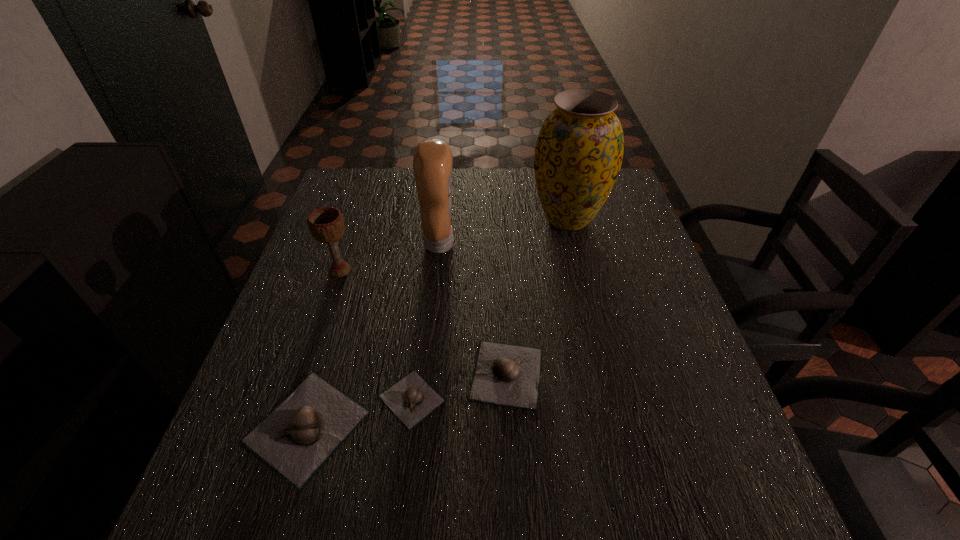
Where is `the leftmost garlic`? Image resolution: width=960 pixels, height=540 pixels. the leftmost garlic is located at coordinates (298, 437).

What are the coordinates of `the shortest garlic` in the screenshot? It's located at (411, 399).

This screenshot has height=540, width=960. Find the location of `the second garlic from left to right`. the second garlic from left to right is located at coordinates (411, 399).

Identify the location of the rightmost garlic. This screenshot has width=960, height=540. (504, 374).

Locate an element on the screen. Image resolution: width=960 pixels, height=540 pixels. the second shortest object is located at coordinates (504, 374).

Where is `condiment`? condiment is located at coordinates (432, 163).

This screenshot has width=960, height=540. I want to click on the rightmost object, so click(579, 151).

Where is `the tallest object`? This screenshot has height=540, width=960. the tallest object is located at coordinates (579, 151).

The height and width of the screenshot is (540, 960). Identify the location of chalice. (326, 224).

Identify the location of vacant space located 0.300m on the back of the leftmost garlic. The image size is (960, 540). (353, 272).